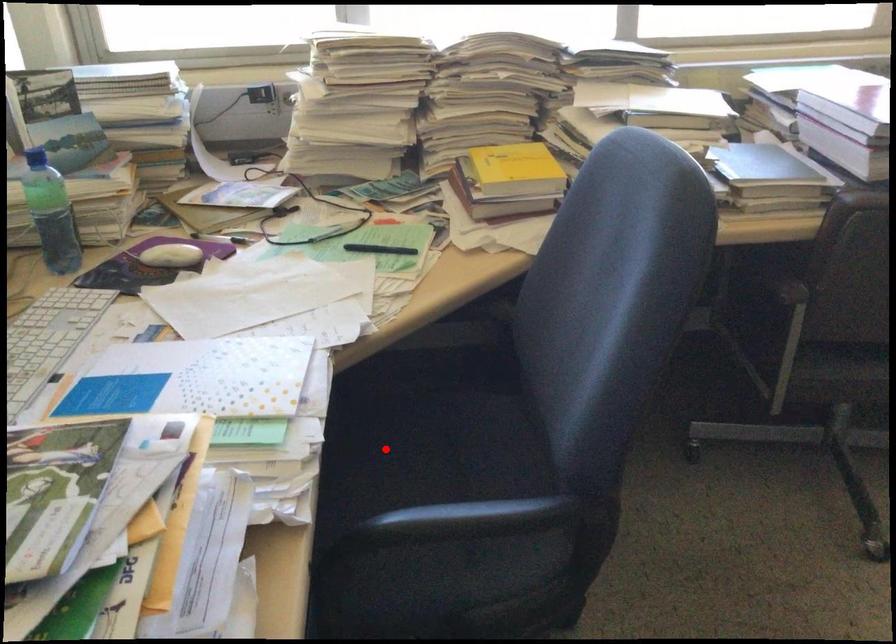
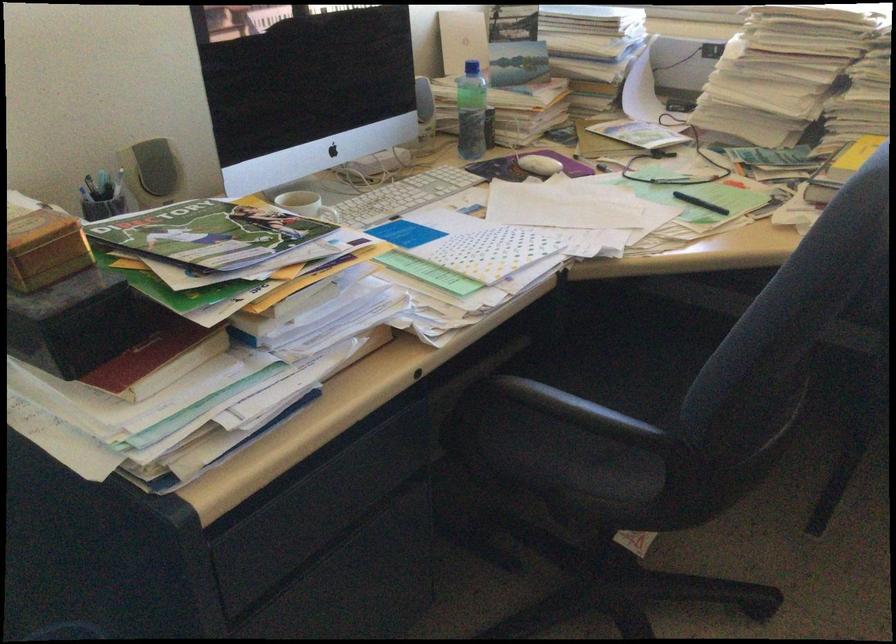
Locate, in the second image, the point that corresponds to the highlighted location in the first image.

(618, 365)